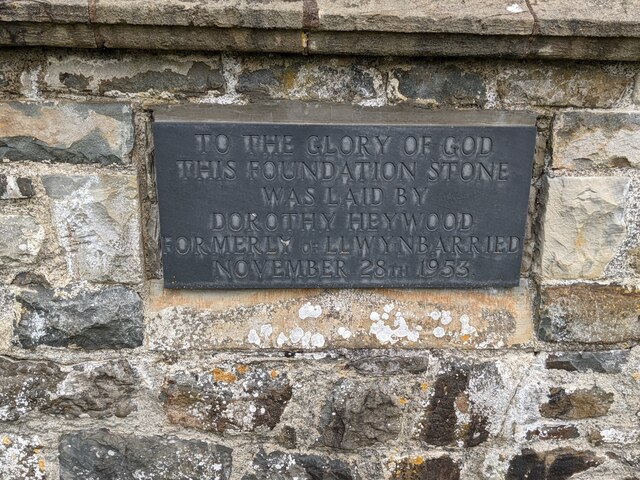
This screenshot has width=640, height=480. I want to click on historical wall, so coord(320,425).